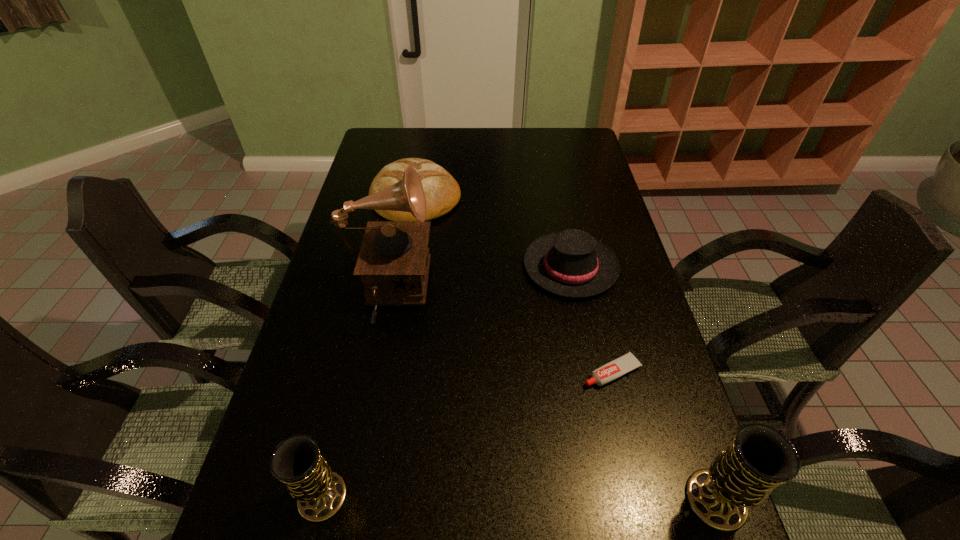
This screenshot has width=960, height=540. What are the coordinates of `dress hat that is at the right edge` in the screenshot? It's located at (571, 263).

Find the location of a particular element. This screenshot has width=960, height=540. object located at the near left corner is located at coordinates (320, 492).

At what (x,y) coordinates should I click in order to perform the action: click on object that is positioned at the near right corner. Please return your answer as a coordinate pair (x, y). The image size is (960, 540). Looking at the image, I should click on (760, 458).

Locate an element on the screen. The height and width of the screenshot is (540, 960). vacant space at the far edge of the desktop is located at coordinates (428, 133).

In the image, there is a desktop. Where is `vacant area at the near edge`? vacant area at the near edge is located at coordinates (539, 504).

The height and width of the screenshot is (540, 960). In order to click on free space at the left edge in this screenshot , I will do `click(342, 389)`.

Identify the location of vacant region at the right edge. (648, 314).

Locate an element on the screen. This screenshot has width=960, height=540. vacant space at the far left corner is located at coordinates (406, 128).

Identify the location of free space between the tallest object and the shorter chalice. This screenshot has width=960, height=540. (355, 395).

Locate an element on the screen. The width and height of the screenshot is (960, 540). vacant area that lies between the record player and the taller chalice is located at coordinates (551, 397).